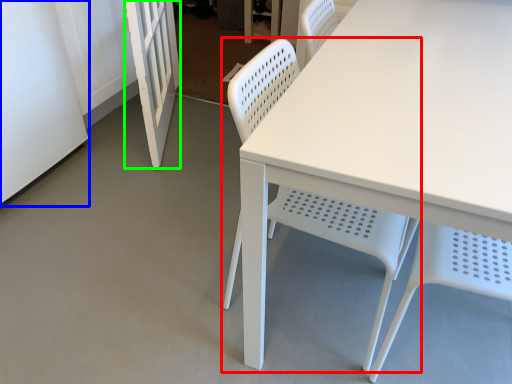
Question: Which object is the closest to the chair (highlighted by a red box)? Choose among these: screen door (highlighted by a blue box) or screen door (highlighted by a green box).

Choices:
 (A) screen door
 (B) screen door

Answer: (B)